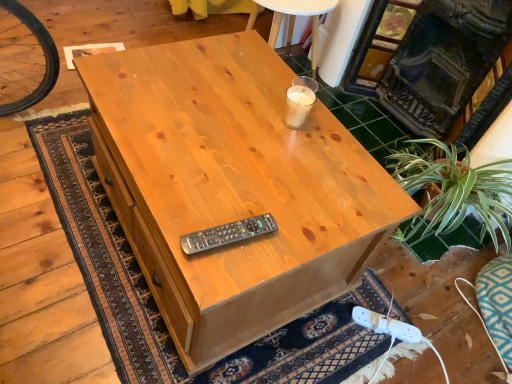
Locate an element on the screen. unoccupied space behind black plastic remote at center is located at coordinates (241, 184).